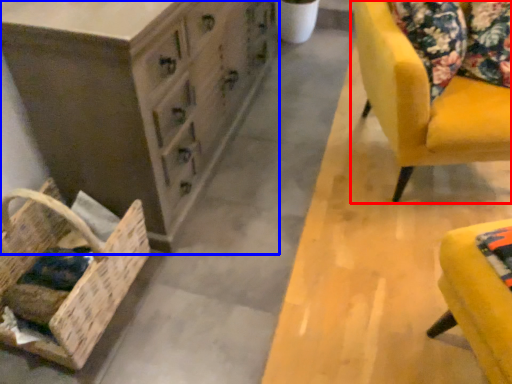
Question: Among these objects, which one is farthest to the camera, chair (highlighted by a red box) or chest of drawers (highlighted by a blue box)?

Choices:
 (A) chair
 (B) chest of drawers

Answer: (A)